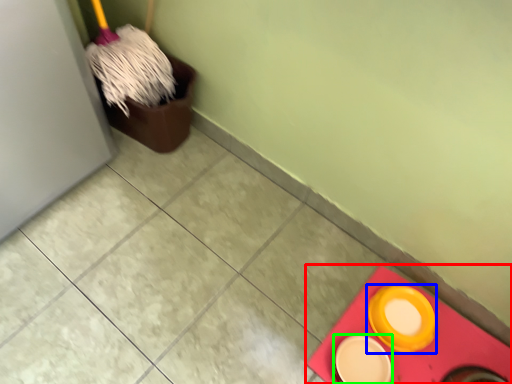
Question: Which is nearer to the tile (highlighted by a red box)? tableware (highlighted by a blue box) or tableware (highlighted by a green box).

Choices:
 (A) tableware
 (B) tableware

Answer: (A)